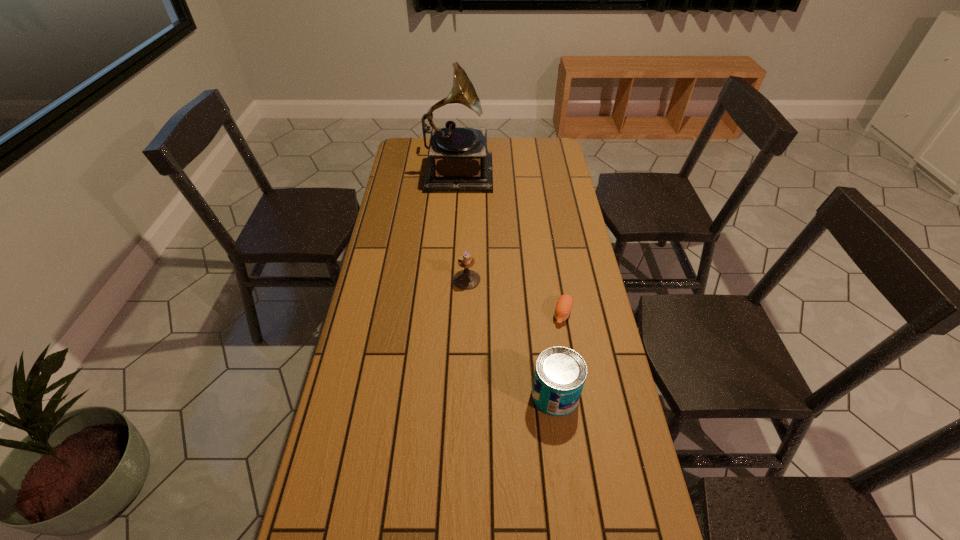
Identify the location of object that is at the far edge. point(458,160).

You are a GUI agent. You are given a task and a screenshot of the screen. Output one action in this format:
    pyautogui.click(x=<x>, y=<y>)
    Task: Click on the object present at the left edge
    
    Given the screenshot: What is the action you would take?
    pyautogui.click(x=458, y=160)

Locate an element on the screen. The height and width of the screenshot is (540, 960). can that is at the right edge is located at coordinates (560, 373).

This screenshot has width=960, height=540. I want to click on sushi positioned at the right edge, so click(563, 308).

Identify the location of object that is at the far left corner. (458, 160).

In the image, there is a desktop. Identify the location of vacant space at the far edge. The image size is (960, 540). (495, 155).

Where is `vacant point at the left edge`? vacant point at the left edge is located at coordinates (395, 173).

I want to click on free space at the right edge of the desktop, so click(x=608, y=431).

At what (x,y) coordinates should I click in order to perform the action: click on vacant area that lies between the sushi and the tallest object. Please return your answer as a coordinate pair (x, y). The height and width of the screenshot is (540, 960). Looking at the image, I should click on (510, 241).

The height and width of the screenshot is (540, 960). Find the location of `unoccupied position between the second farthest object and the nearest object`. unoccupied position between the second farthest object and the nearest object is located at coordinates (511, 338).